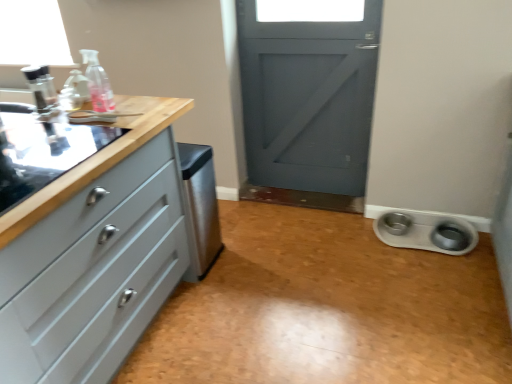
Question: From a real-world perspective, is satin stainless steel dishwasher at center over transparent plastic bottle at upper left?

Choices:
 (A) yes
 (B) no

Answer: (B)

Question: Considering the relative positions of satin stainless steel dishwasher at center and transparent plastic bottle at upper left in the image provided, is satin stainless steel dishwasher at center in front of transparent plastic bottle at upper left?

Choices:
 (A) no
 (B) yes

Answer: (A)

Question: From the image's perspective, is satin stainless steel dishwasher at center on transparent plastic bottle at upper left?

Choices:
 (A) no
 (B) yes

Answer: (A)

Question: Does satin stainless steel dishwasher at center appear on the right side of transparent plastic bottle at upper left?

Choices:
 (A) yes
 (B) no

Answer: (A)

Question: Can you confirm if satin stainless steel dishwasher at center is bigger than transparent plastic bottle at upper left?

Choices:
 (A) no
 (B) yes

Answer: (B)

Question: Could you tell me if satin stainless steel dishwasher at center is facing transparent plastic bottle at upper left?

Choices:
 (A) no
 (B) yes

Answer: (A)

Question: Considering the relative positions of matte gray chest of drawers at left and white plastic pet bowls at lower right in the image provided, is matte gray chest of drawers at left to the left of white plastic pet bowls at lower right from the viewer's perspective?

Choices:
 (A) yes
 (B) no

Answer: (A)

Question: Does matte gray chest of drawers at left have a lesser height compared to white plastic pet bowls at lower right?

Choices:
 (A) yes
 (B) no

Answer: (B)

Question: Are matte gray chest of drawers at left and white plastic pet bowls at lower right beside each other?

Choices:
 (A) yes
 (B) no

Answer: (B)

Question: Does matte gray chest of drawers at left come in front of white plastic pet bowls at lower right?

Choices:
 (A) no
 (B) yes

Answer: (B)

Question: From the image's perspective, is matte gray chest of drawers at left on white plastic pet bowls at lower right?

Choices:
 (A) yes
 (B) no

Answer: (A)

Question: Does matte gray chest of drawers at left turn towards white plastic pet bowls at lower right?

Choices:
 (A) no
 (B) yes

Answer: (B)

Question: Is white glossy pet bowls at lower right not inside matte gray chest of drawers at left?

Choices:
 (A) yes
 (B) no

Answer: (A)